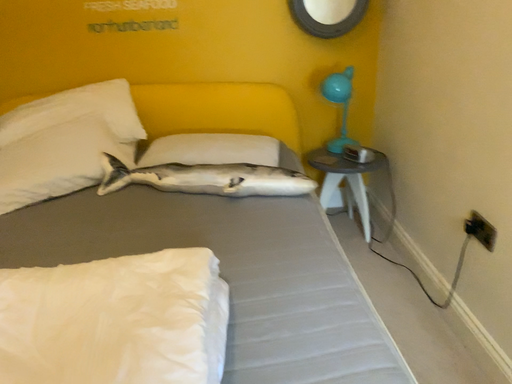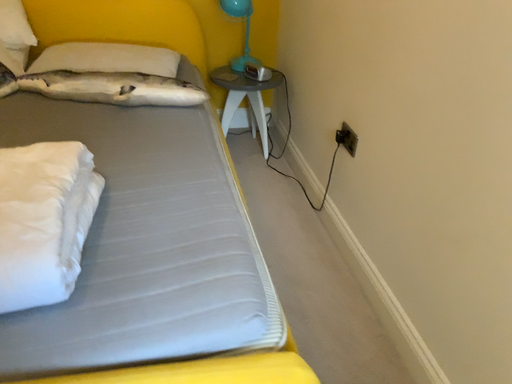
Question: How did the camera likely rotate when shooting the video?

Choices:
 (A) rotated upward
 (B) rotated downward

Answer: (B)